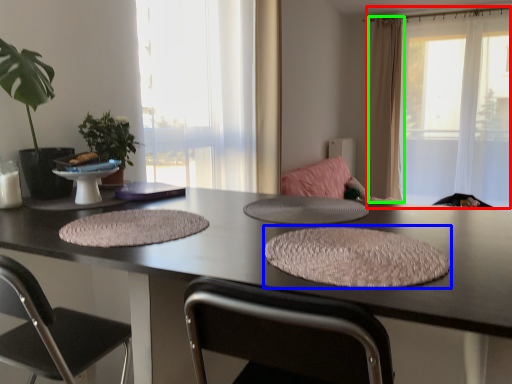
Question: Which object is the closest to the window (highlighted by a red box)? Choose among these: yoga mat (highlighted by a blue box) or curtain (highlighted by a green box).

Choices:
 (A) yoga mat
 (B) curtain

Answer: (B)